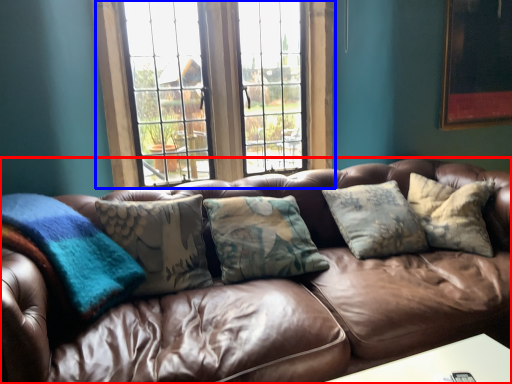
Question: Which object is further to the camera taking this photo, studio couch (highlighted by a red box) or window (highlighted by a blue box)?

Choices:
 (A) studio couch
 (B) window

Answer: (B)